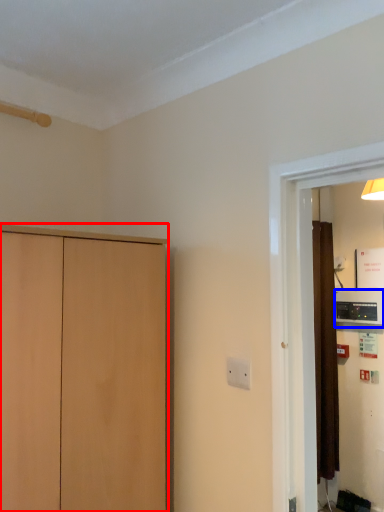
Question: Among these objects, which one is nearest to the camera, cupboard (highlighted by a red box) or appliance (highlighted by a blue box)?

Choices:
 (A) cupboard
 (B) appliance

Answer: (A)